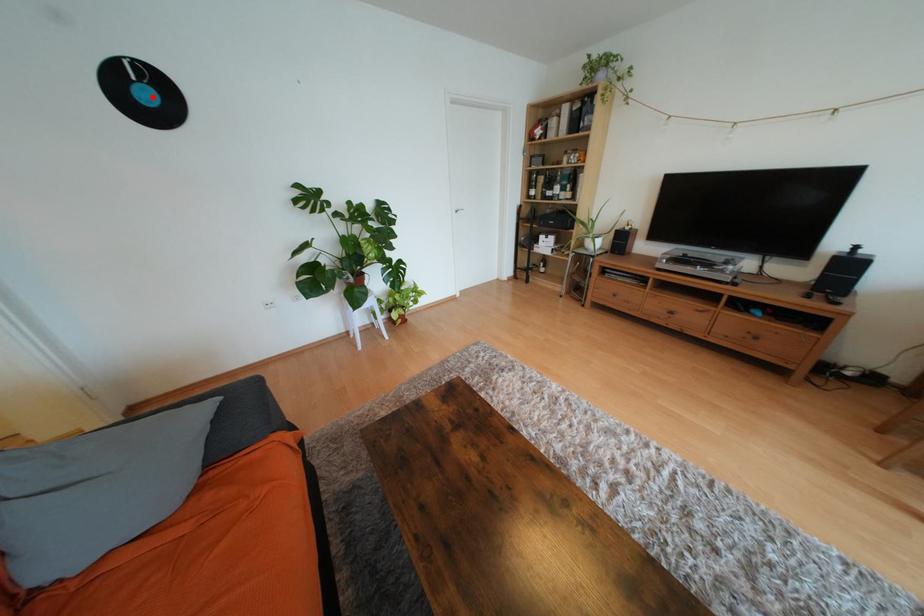
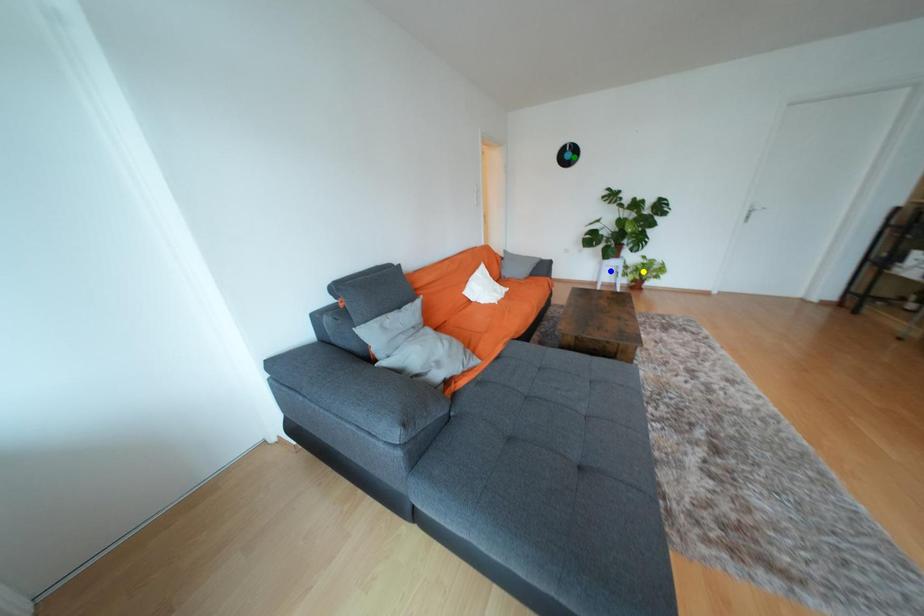
Question: I am providing you with two images of the same scene from different viewpoints. A red point is marked on the first image. You are given multiple points on the second image. Which mark in image 2 goes with the point in image 1?

Choices:
 (A) yellow point
 (B) blue point
 (C) green point

Answer: (C)